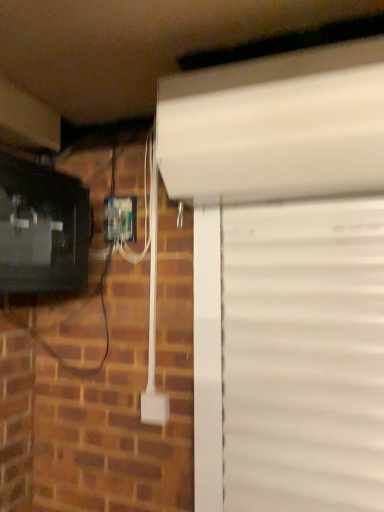
What do you see at coordinates (120, 219) in the screenshot? This screenshot has width=384, height=512. I see `white plastic electric outlet at center` at bounding box center [120, 219].

I want to click on white plastic electric outlet at center, so click(x=120, y=219).

Locate an element on the screen. white plastic electric outlet at center is located at coordinates (120, 219).